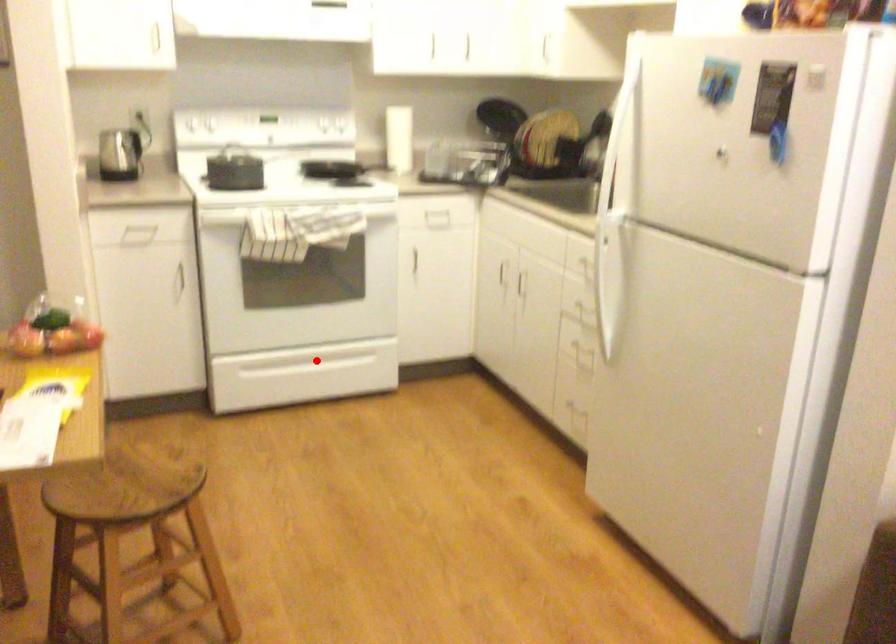
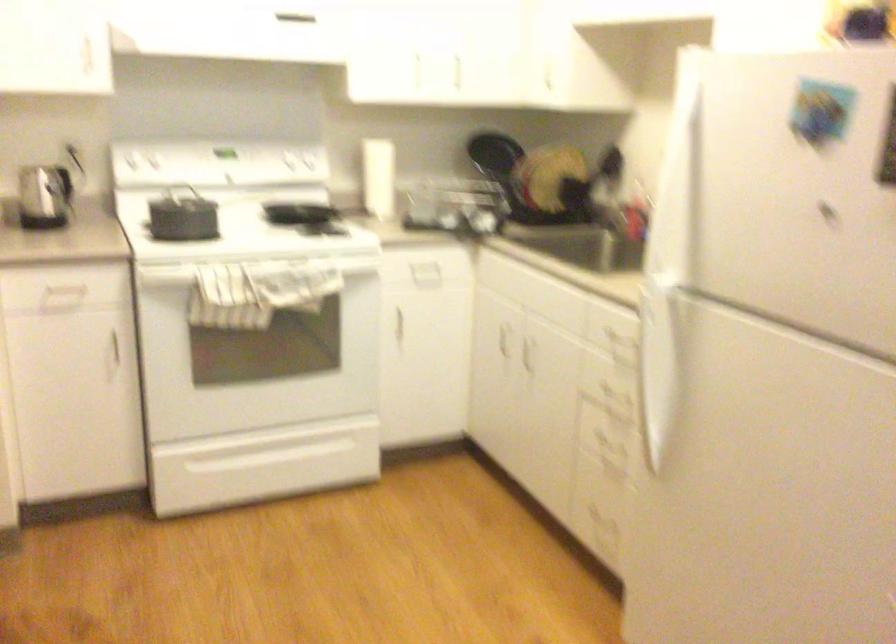
Question: I am providing you with two images of the same scene from different viewpoints. A red point is marked on the first image. Can you still see the location of the red point in image 2?

Choices:
 (A) Yes
 (B) No

Answer: (A)